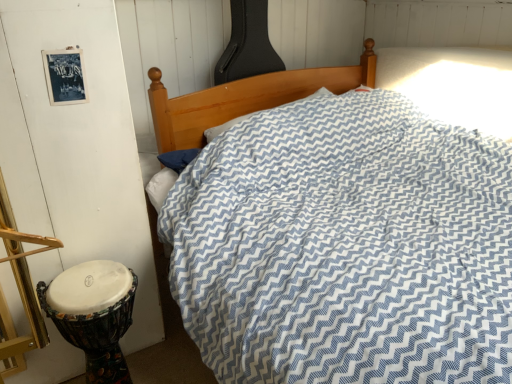
Identify the location of free space above white textured drum at lower left (from a real-world perspective). The width and height of the screenshot is (512, 384). (84, 283).